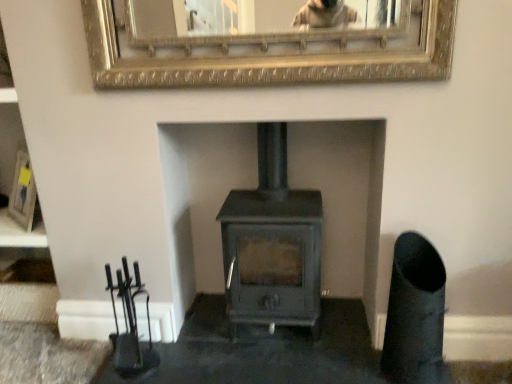
Where is `vacant area that is in front of matte gray wood burning stove at center`? This screenshot has width=512, height=384. vacant area that is in front of matte gray wood burning stove at center is located at coordinates (281, 368).